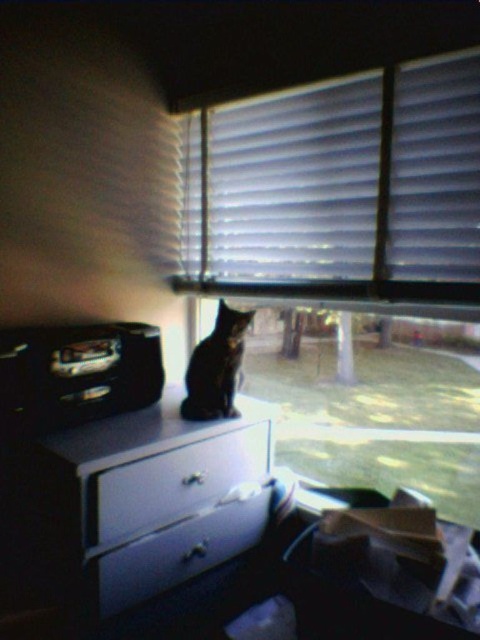
Question: Is white glossy dresser at center wider than white glossy drawer at center?

Choices:
 (A) yes
 (B) no

Answer: (A)

Question: Which of these objects is positioned farthest from the shiny black cat at center?

Choices:
 (A) metallic black radio at left
 (B) white glossy drawer at lower center

Answer: (A)

Question: Which object appears closest to the camera in this image?

Choices:
 (A) white glossy drawer at center
 (B) shiny black cat at center
 (C) white glossy dresser at center

Answer: (C)

Question: Based on their relative distances, which object is farther from the white textured blinds at upper center?

Choices:
 (A) metallic black radio at left
 (B) white glossy drawer at center
 (C) white glossy drawer at lower center

Answer: (B)

Question: Does white textured blinds at upper center have a lesser width compared to shiny black cat at center?

Choices:
 (A) no
 (B) yes

Answer: (A)

Question: Does white glossy dresser at center appear on the left side of shiny black cat at center?

Choices:
 (A) no
 (B) yes

Answer: (B)